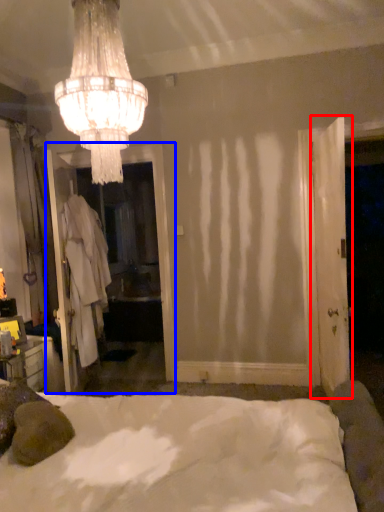
Question: Which object appears closest to the camera in this image, door (highlighted by a red box) or screen door (highlighted by a blue box)?

Choices:
 (A) door
 (B) screen door

Answer: (A)